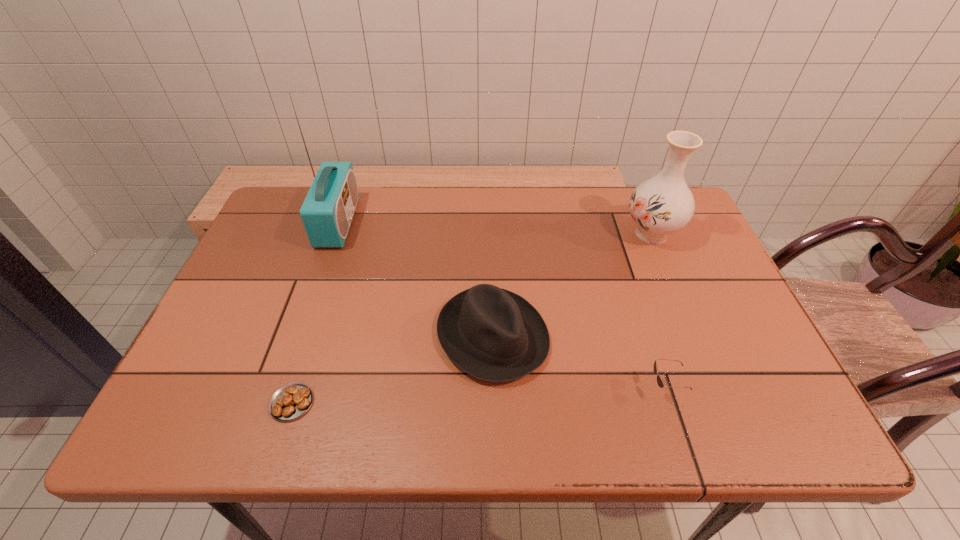
This screenshot has height=540, width=960. What are the coordinates of `free spot between the fourth shortest object and the third object from right to left` in the screenshot? It's located at (572, 285).

The width and height of the screenshot is (960, 540). I want to click on free space between the pastry and the tallest object, so click(315, 313).

Locate an element on the screen. unoccupied area between the third object from left to right and the pastry is located at coordinates (393, 369).

Where is `vacant area between the fedora and the sunglasses`? The width and height of the screenshot is (960, 540). vacant area between the fedora and the sunglasses is located at coordinates (579, 362).

Identify the location of free space that is in between the third object from right to left and the second shortest object. Image resolution: width=960 pixels, height=540 pixels. (579, 362).

You are a GUI agent. You are given a task and a screenshot of the screen. Output one action in this format:
    pyautogui.click(x=<x>, y=<y>)
    Task: Click on the vacant space that is in between the shortest object and the tallest object
    This screenshot has height=540, width=960.
    Given the screenshot: What is the action you would take?
    pyautogui.click(x=315, y=313)

Find the location of a particular element. the second closest object relative to the fedora is located at coordinates (291, 401).

At what (x,y) coordinates should I click in order to perform the action: click on object that is the closest one to the tallest object. Please return your answer as a coordinate pair (x, y). Looking at the image, I should click on (493, 334).

Find the location of `free space in the image that satisfies the following two spatial constraints: 1. on the front panel of the tallest object; 2. on the right side of the vase`. free space in the image that satisfies the following two spatial constraints: 1. on the front panel of the tallest object; 2. on the right side of the vase is located at coordinates (334, 234).

The image size is (960, 540). I want to click on vacant space that satisfies the following two spatial constraints: 1. on the front panel of the vase; 2. on the right side of the tallest object, so click(334, 234).